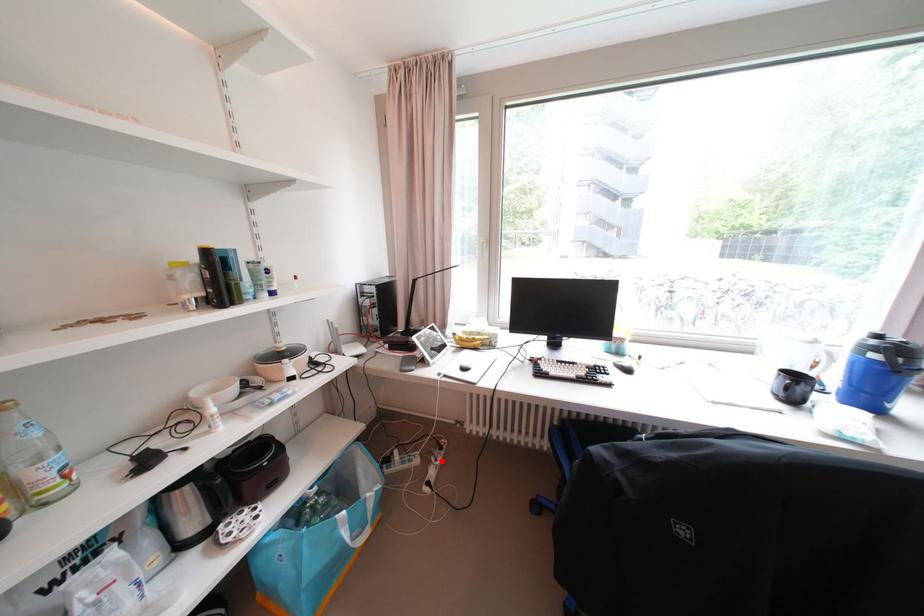
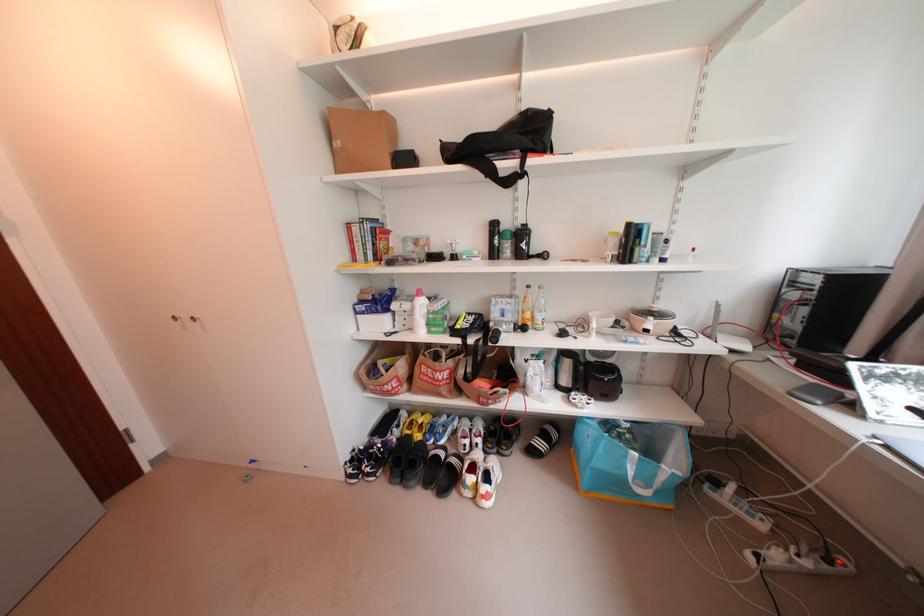
Question: I am providing you with two images of the same scene from different viewpoints. In image1, a red point is highlighted. Considering the same 3D point in image2, which of the following is correct?

Choices:
 (A) It is closer
 (B) It is farther

Answer: (B)